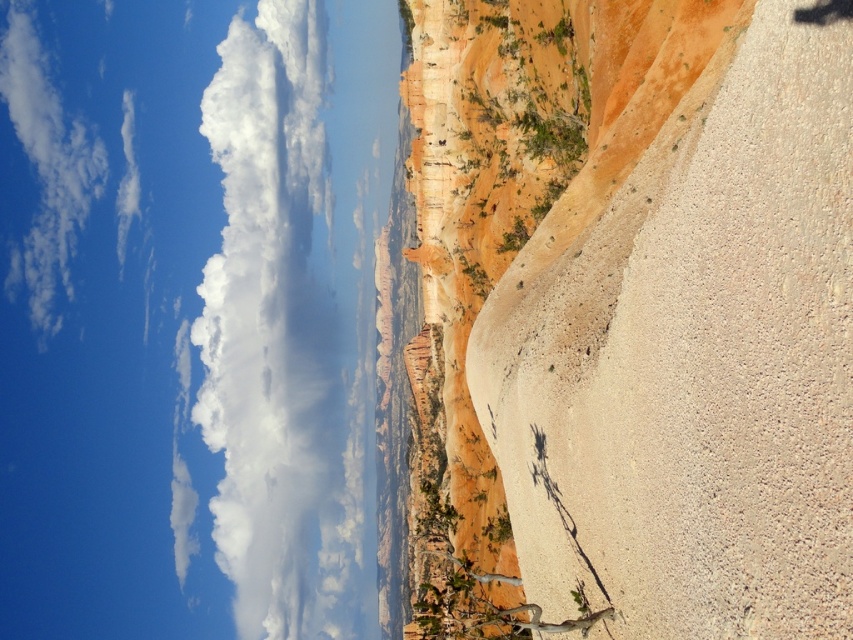
Question: Can you confirm if rustic sandstone cliff at right is positioned above white fluffy cloud at upper left?

Choices:
 (A) yes
 (B) no

Answer: (A)

Question: Does rustic sandstone cliff at right have a lesser width compared to white fluffy cloud at upper left?

Choices:
 (A) yes
 (B) no

Answer: (A)

Question: From the image, what is the correct spatial relationship of rustic sandstone cliff at right in relation to white fluffy cloud at upper left?

Choices:
 (A) left
 (B) right

Answer: (B)

Question: Which point is farther to the camera?

Choices:
 (A) rustic sandstone cliff at right
 (B) white fluffy cloud at upper left

Answer: (B)

Question: Among these points, which one is farthest from the camera?

Choices:
 (A) (798, 17)
 (B) (228, 353)

Answer: (B)